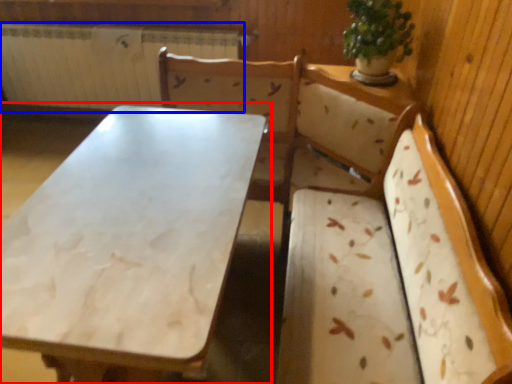
Question: Which of the following is the closest to the observer, table (highlighted by a red box) or radiator (highlighted by a blue box)?

Choices:
 (A) table
 (B) radiator

Answer: (A)